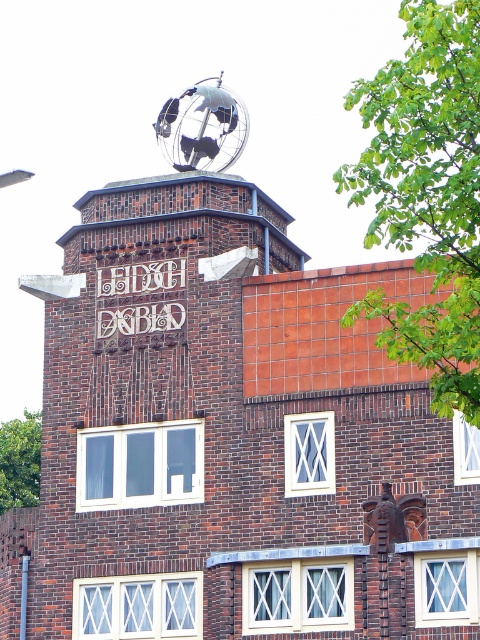
Does metallic globe at top have a greater width compared to white ceramic sign at center?

Correct, the width of metallic globe at top exceeds that of white ceramic sign at center.

The width and height of the screenshot is (480, 640). Describe the element at coordinates (203, 125) in the screenshot. I see `metallic globe at top` at that location.

Locate an element on the screen. The width and height of the screenshot is (480, 640). metallic globe at top is located at coordinates (203, 125).